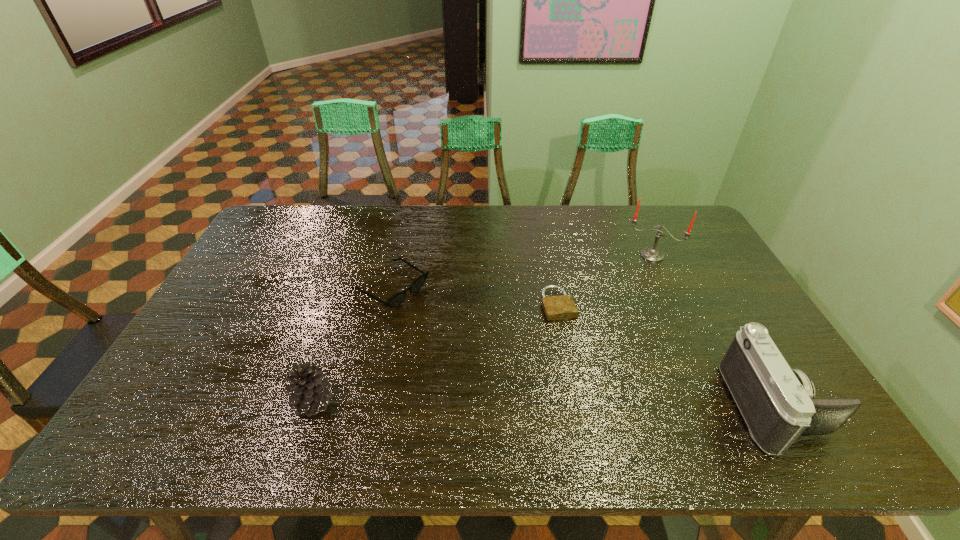
I want to click on object that is at the near right corner, so click(777, 403).

What are the coordinates of `vacant region at the far edge of the desktop` in the screenshot? It's located at (448, 225).

Image resolution: width=960 pixels, height=540 pixels. I want to click on vacant region at the near edge of the desktop, so click(x=524, y=394).

The width and height of the screenshot is (960, 540). In order to click on free region at the left edge of the desktop in this screenshot , I will do `click(257, 306)`.

Find the location of a particular element. The image size is (960, 540). free space at the right edge of the desktop is located at coordinates (695, 255).

Where is `free space that is in between the second tallest object and the pinecone`? free space that is in between the second tallest object and the pinecone is located at coordinates (544, 404).

Identify the location of free space between the sunglasses and the pinecone. This screenshot has height=540, width=960. (352, 345).

This screenshot has width=960, height=540. In order to click on unoccupied area between the fourth tallest object and the fourth shortest object in this screenshot , I will do `click(583, 347)`.

Locate an element on the screen. vacant point located between the candle and the fourth tallest object is located at coordinates (521, 271).

Where is `vacant space that is in between the third shortest object and the candle`? This screenshot has height=540, width=960. vacant space that is in between the third shortest object and the candle is located at coordinates (483, 328).